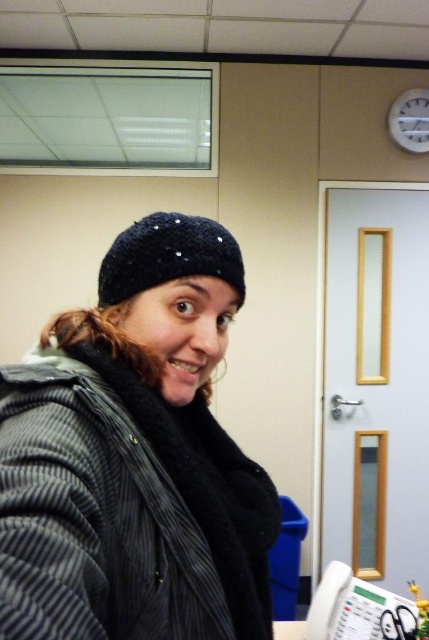
Question: Can you confirm if striped woolen jacket at center is bigger than black knitted hat at center?

Choices:
 (A) yes
 (B) no

Answer: (A)

Question: Estimate the real-world distances between objects in this image. Which object is farther from the striped woolen jacket at center?

Choices:
 (A) white plastic clock at upper right
 (B) black knitted hat at center

Answer: (A)

Question: From the image, what is the correct spatial relationship of black knitted hat at center in relation to white plastic clock at upper right?

Choices:
 (A) below
 (B) above

Answer: (A)

Question: Which of these objects is positioned farthest from the black knitted hat at center?

Choices:
 (A) white plastic clock at upper right
 (B) striped woolen jacket at center

Answer: (A)

Question: Where is striped woolen jacket at center located in relation to black knitted hat at center in the image?

Choices:
 (A) right
 (B) left

Answer: (B)

Question: Which object is closer to the camera taking this photo?

Choices:
 (A) white plastic clock at upper right
 (B) striped woolen jacket at center
 (C) black knitted hat at center

Answer: (B)